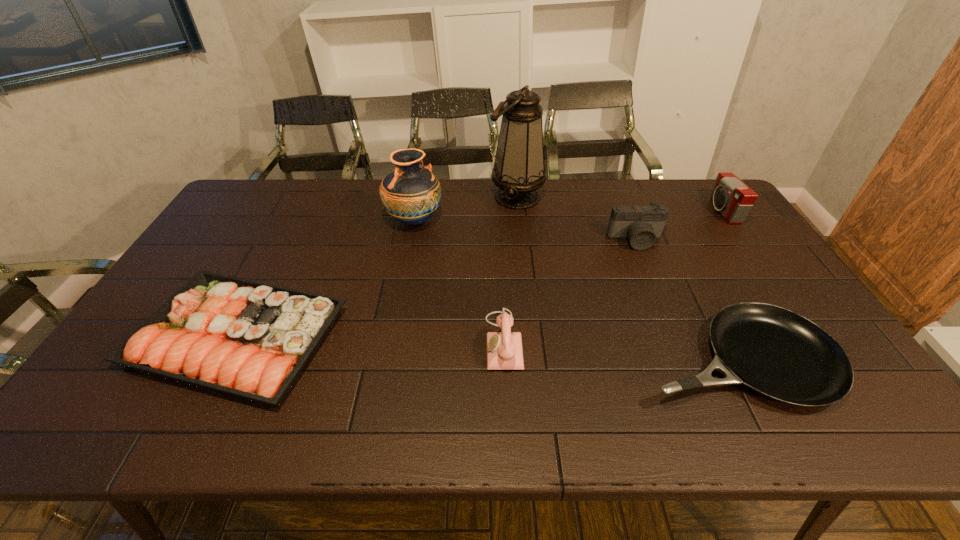
At what (x,y) coordinates should I click in order to perform the action: click on free region at the far edge. Please return your answer as a coordinate pair (x, y). Image resolution: width=960 pixels, height=540 pixels. Looking at the image, I should click on (484, 190).

Locate an element on the screen. free region at the near edge of the desktop is located at coordinates 259,426.

Find the location of a particular element. free space at the far left corner of the desktop is located at coordinates (261, 178).

The image size is (960, 540). In the image, there is a desktop. Identify the location of free space at the far right corner. (691, 196).

Where is `free area in between the right camera and the telephone`? This screenshot has width=960, height=540. free area in between the right camera and the telephone is located at coordinates (612, 276).

Find the location of `free spot between the telephone and the tallest object`. free spot between the telephone and the tallest object is located at coordinates (510, 269).

Locate an element on the screen. This screenshot has width=960, height=540. empty space that is in between the oil lamp and the telephone is located at coordinates (510, 269).

Image resolution: width=960 pixels, height=540 pixels. Find the location of `unoccupied position between the tallest object and the sixth object from right to left`. unoccupied position between the tallest object and the sixth object from right to left is located at coordinates (466, 209).

Where is `free area in between the oil lamp and the left camera`? Image resolution: width=960 pixels, height=540 pixels. free area in between the oil lamp and the left camera is located at coordinates (576, 219).

Where is `blank region between the telephone and the pan`? This screenshot has height=540, width=960. blank region between the telephone and the pan is located at coordinates (620, 350).